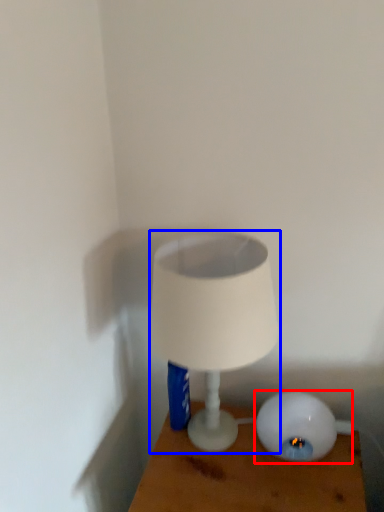
Question: Which point is further to the camera, lamp (highlighted by a red box) or lamp (highlighted by a blue box)?

Choices:
 (A) lamp
 (B) lamp

Answer: (A)